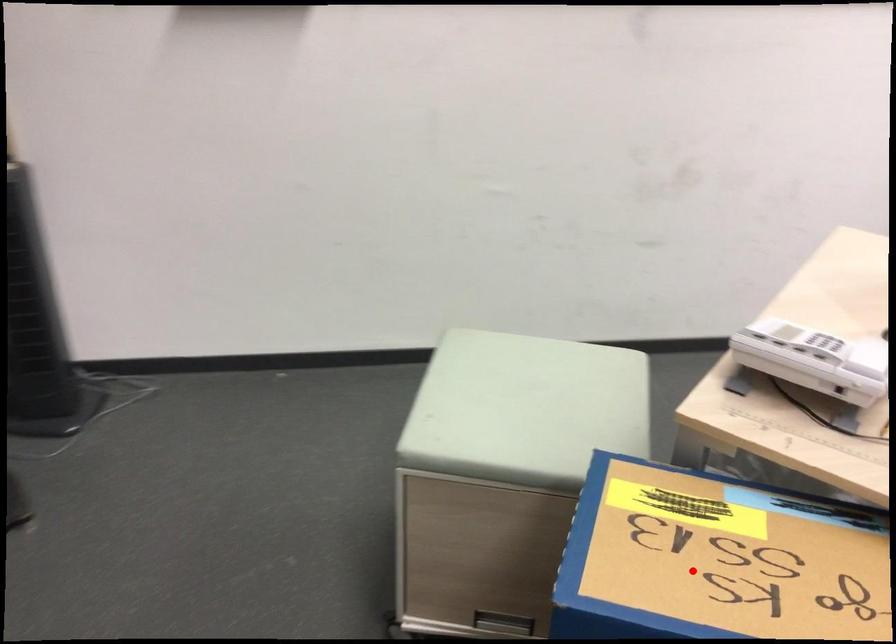
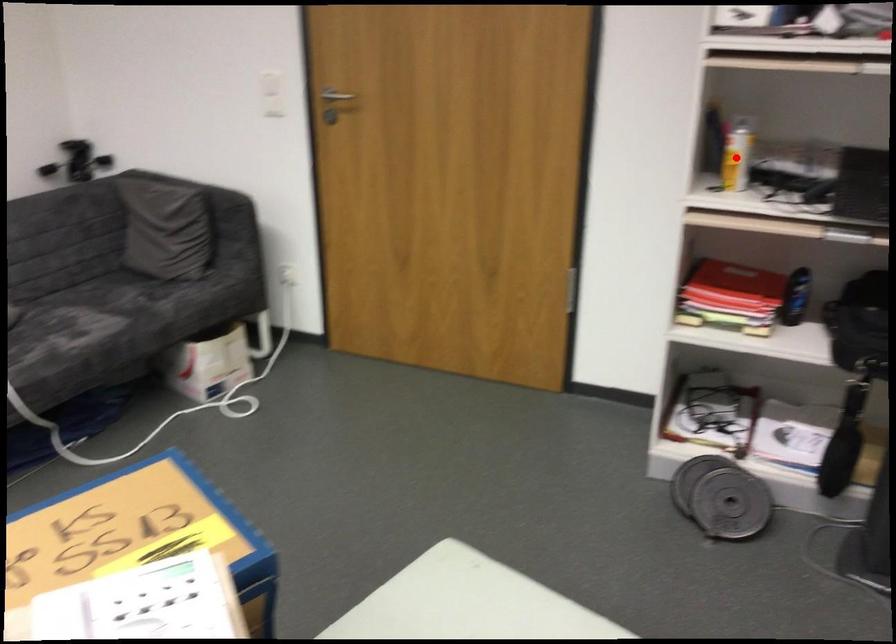
I am providing you with two images of the same scene from different viewpoints. A red point is marked on the first image and another point is marked on the second image. Are the points marked in image1 and image2 representing the same 3D position?

No